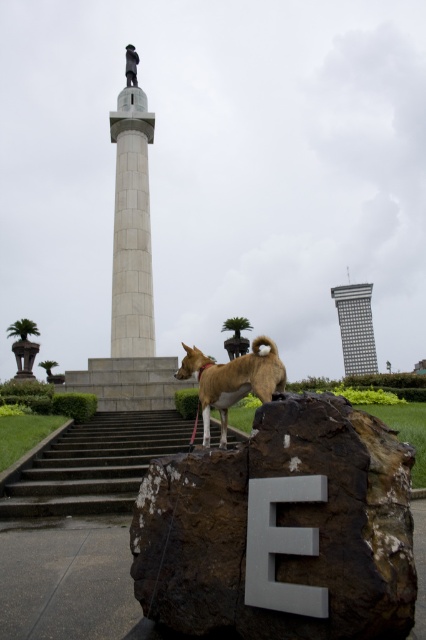
You are standing at the base of the monument and want to walk to the green leafy palm tree at lower left. There are dark gray concrete stairs at lower left in your way. Can you walk around the stairs to reach the palm tree without climbing them?

The dark gray concrete stairs at lower left are 25.02 meters away from the green leafy palm tree at lower left. Since the stairs are between you and the palm tree, you can walk around them to reach the palm tree without needing to climb the stairs.

You are standing in front of the monument and want to take a photo of the golden fur dog at center without the polished bronze statue at upper center blocking the view. Is this possible given their positions?

The golden fur dog at center is positioned under the polished bronze statue at upper center, so if you take a photo from a lower angle, you can capture the dog without the statue blocking it.

You are standing at the bottom of the dark gray concrete stairs at lower left and want to see the golden fur dog at center. Can you see the dog without moving your head?

The golden fur dog at center is behind dark gray concrete stairs at lower left, so you cannot see it from your current position without moving your head.